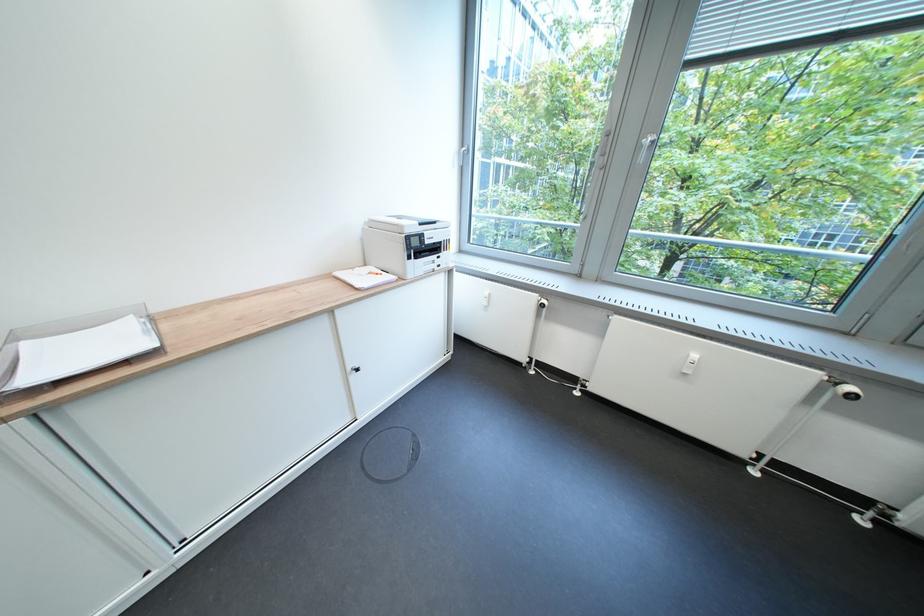
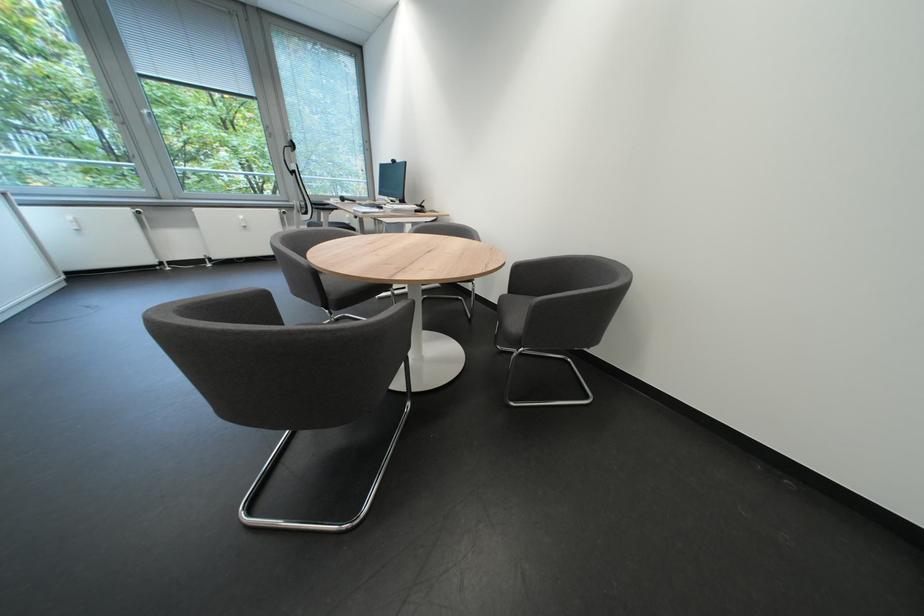
Where in the second image is the point corresponding to point (719, 172) from the first image?

(248, 146)